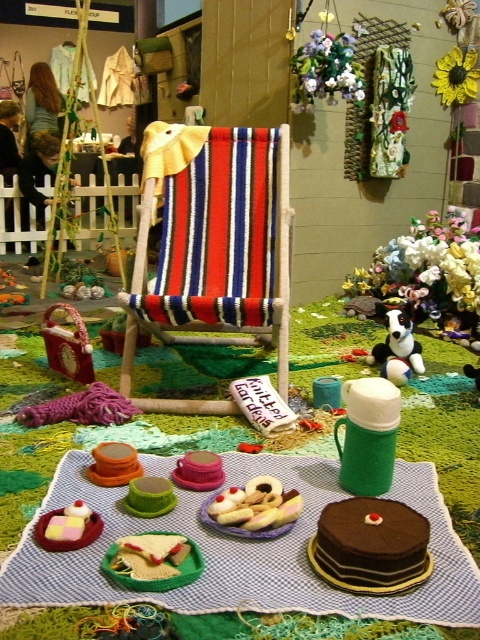
Is velvety green tablecloth at center further to the viewer compared to smooth white cream puff at center?

No, velvety green tablecloth at center is closer to the viewer.

Can you confirm if velvety green tablecloth at center is positioned above smooth white cream puff at center?

Incorrect, velvety green tablecloth at center is not positioned above smooth white cream puff at center.

Who is more forward, (x=104, y=499) or (x=251, y=506)?

Positioned in front is point (x=251, y=506).

Identify the location of velvety green tablecloth at center. The width and height of the screenshot is (480, 640). (245, 550).

Does knitted fabric chair at center have a lesser height compared to black plush dog at center?

No, knitted fabric chair at center is not shorter than black plush dog at center.

The image size is (480, 640). Describe the element at coordinates (213, 244) in the screenshot. I see `knitted fabric chair at center` at that location.

Between point (180, 202) and point (394, 340), which one is positioned behind?

Point (394, 340)

Identify the location of knitted fabric chair at center. Image resolution: width=480 pixels, height=640 pixels. [213, 244].

Is chocolatesmoothcake at center closer to camera compared to black plush dog at center?

Yes, chocolatesmoothcake at center is closer to the viewer.

Who is lower down, chocolatesmoothcake at center or black plush dog at center?

Positioned lower is chocolatesmoothcake at center.

Is point (421, 540) positioned after point (372, 362)?

That is False.

Where is `chocolatesmoothcake at center`? This screenshot has width=480, height=640. chocolatesmoothcake at center is located at coordinates (371, 547).